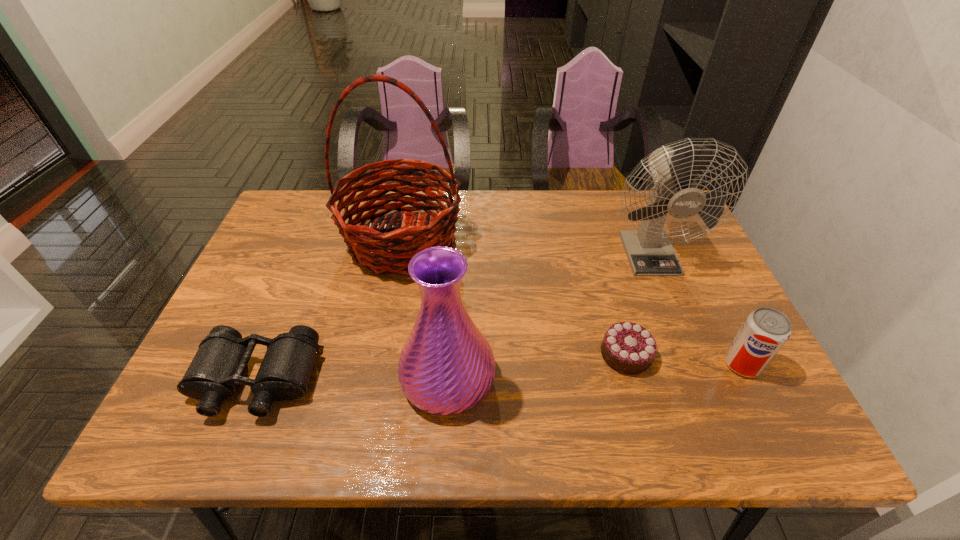
In the image, there is a desktop. Where is `blank space at the far edge`? Image resolution: width=960 pixels, height=540 pixels. blank space at the far edge is located at coordinates (598, 218).

Locate an element on the screen. vacant space at the near edge is located at coordinates (377, 443).

Find the location of a particular element. The image size is (960, 540). vacant space at the left edge of the desktop is located at coordinates (255, 280).

Image resolution: width=960 pixels, height=540 pixels. Identify the location of free region at the right edge. (713, 335).

Image resolution: width=960 pixels, height=540 pixels. Find the location of `free spot at the near left corner of the desktop`. free spot at the near left corner of the desktop is located at coordinates [231, 408].

In the image, there is a desktop. What are the coordinates of `vacant space at the near right corner` in the screenshot? It's located at (782, 423).

You are a GUI agent. You are given a task and a screenshot of the screen. Output one action in this format:
    pyautogui.click(x=<x>, y=<y>)
    Task: Click on the empty space that is in between the tallest object and the second shortest object
    The image size is (960, 540).
    Given the screenshot: What is the action you would take?
    pyautogui.click(x=329, y=311)

Image resolution: width=960 pixels, height=540 pixels. In order to click on free space between the tallest object and the fan in this screenshot , I will do `click(525, 247)`.

Identify the location of free spot between the fan and the chocolate cake. (637, 303).

The width and height of the screenshot is (960, 540). I want to click on free point between the fan and the vase, so click(548, 315).